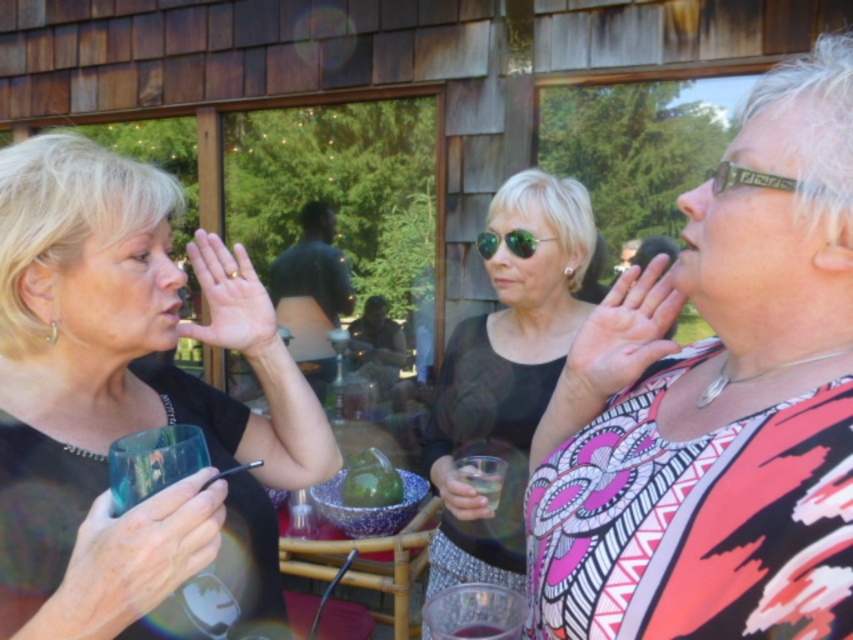
Which is above, printed fabric blouse at center or matte black shirt at left?

printed fabric blouse at center

Which is more to the right, printed fabric blouse at center or matte black shirt at left?

printed fabric blouse at center

Find the location of a particular element. printed fabric blouse at center is located at coordinates (715, 403).

Is matte black dress at center bigger than green reflective sunglasses at center?

Correct, matte black dress at center is larger in size than green reflective sunglasses at center.

Is point (556, 328) more distant than point (526, 250)?

Yes, it is.

Between point (468, 369) and point (508, 236), which one is positioned in front?

Point (508, 236) is in front.

Image resolution: width=853 pixels, height=640 pixels. I want to click on matte black dress at center, so click(505, 376).

Based on the photo, does matte black shirt at left have a larger size compared to translucent glass at lower center?

Correct, matte black shirt at left is larger in size than translucent glass at lower center.

Can you confirm if matte black shirt at left is positioned to the right of translucent glass at lower center?

No, matte black shirt at left is not to the right of translucent glass at lower center.

Measure the distance between point (309,428) and camera.

Point (309,428) and camera are 1.32 meters apart from each other.

I want to click on matte black shirt at left, so click(x=129, y=403).